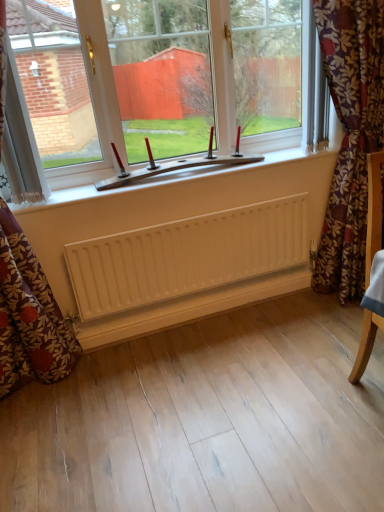
Question: Is white plastic window at center taller than floral fabric curtain at left, acting as the second curtain starting from the right?

Choices:
 (A) no
 (B) yes

Answer: (A)

Question: Is white plastic window at center to the right of floral fabric curtain at left, acting as the second curtain starting from the right, from the viewer's perspective?

Choices:
 (A) no
 (B) yes

Answer: (B)

Question: Is white plastic window at center thinner than floral fabric curtain at left, acting as the second curtain starting from the right?

Choices:
 (A) no
 (B) yes

Answer: (B)

Question: Does white plastic window at center have a larger size compared to floral fabric curtain at left, positioned as the 2th curtain in left-to-right order?

Choices:
 (A) yes
 (B) no

Answer: (B)

Question: From a real-world perspective, is white plastic window at center physically below floral fabric curtain at left, acting as the second curtain starting from the right?

Choices:
 (A) no
 (B) yes

Answer: (A)

Question: Would you say white plastic window at center is a long distance from floral fabric curtain at left, positioned as the 2th curtain in left-to-right order?

Choices:
 (A) yes
 (B) no

Answer: (B)

Question: From the image's perspective, is floral fabric curtain at left, positioned as the 2th curtain in left-to-right order, located beneath floral fabric curtain at right, the first curtain when ordered from right to left?

Choices:
 (A) yes
 (B) no

Answer: (A)

Question: Can you confirm if floral fabric curtain at left, positioned as the 2th curtain in left-to-right order, is taller than floral fabric curtain at right, the first curtain when ordered from right to left?

Choices:
 (A) yes
 (B) no

Answer: (A)

Question: Can you confirm if floral fabric curtain at left, acting as the second curtain starting from the right, is smaller than floral fabric curtain at right, which is the third curtain in left-to-right order?

Choices:
 (A) yes
 (B) no

Answer: (A)

Question: Considering the relative sizes of floral fabric curtain at left, positioned as the 2th curtain in left-to-right order, and floral fabric curtain at right, which is the third curtain in left-to-right order, in the image provided, is floral fabric curtain at left, positioned as the 2th curtain in left-to-right order, shorter than floral fabric curtain at right, which is the third curtain in left-to-right order,?

Choices:
 (A) no
 (B) yes

Answer: (A)

Question: From a real-world perspective, is floral fabric curtain at left, positioned as the 2th curtain in left-to-right order, below floral fabric curtain at right, the first curtain when ordered from right to left?

Choices:
 (A) yes
 (B) no

Answer: (B)

Question: Does floral fabric curtain at left, positioned as the 2th curtain in left-to-right order, have a greater width compared to floral fabric curtain at right, which is the third curtain in left-to-right order?

Choices:
 (A) yes
 (B) no

Answer: (B)

Question: From a real-world perspective, is floral fabric curtain at left, acting as the second curtain starting from the right, physically above white plastic window at center?

Choices:
 (A) yes
 (B) no

Answer: (B)